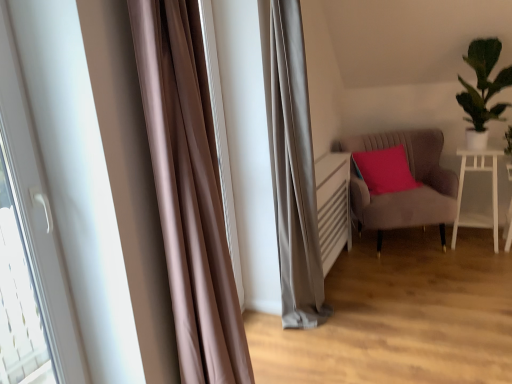
Question: From a real-world perspective, is white glossy table at right physically located above or below green leafy plant at upper right?

Choices:
 (A) above
 (B) below

Answer: (B)

Question: Considering the positions of point (492, 173) and point (470, 147), is point (492, 173) closer or farther from the camera than point (470, 147)?

Choices:
 (A) farther
 (B) closer

Answer: (B)

Question: Which is farther from the white glossy door at left?

Choices:
 (A) suede-like beige armchair at right
 (B) satin brown curtain at left
 (C) white glossy table at right
 (D) green leafy plant at upper right

Answer: (C)

Question: Which of these objects is positioned farthest from the satin brown curtain at left?

Choices:
 (A) white glossy table at right
 (B) suede-like beige armchair at right
 (C) green leafy plant at upper right
 (D) white glossy door at left

Answer: (A)